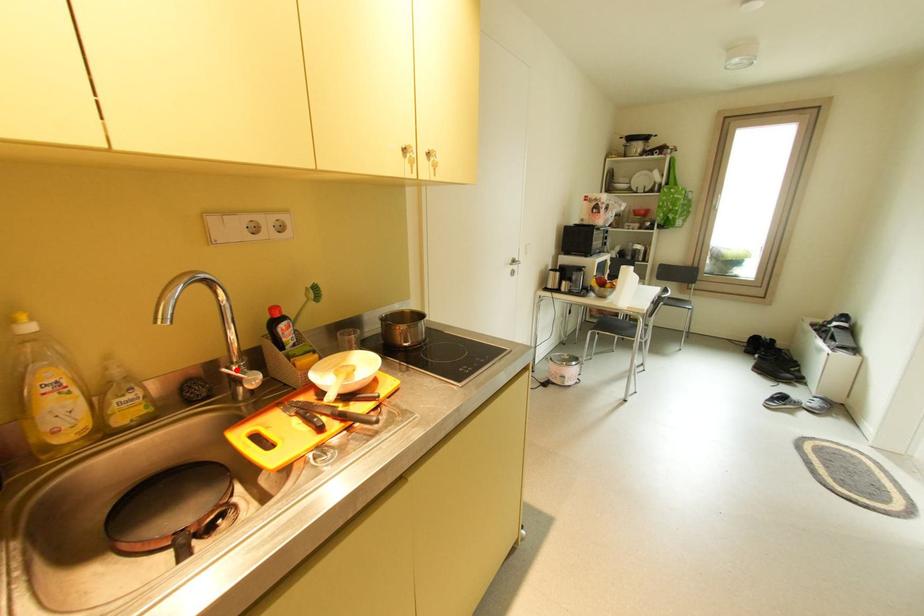
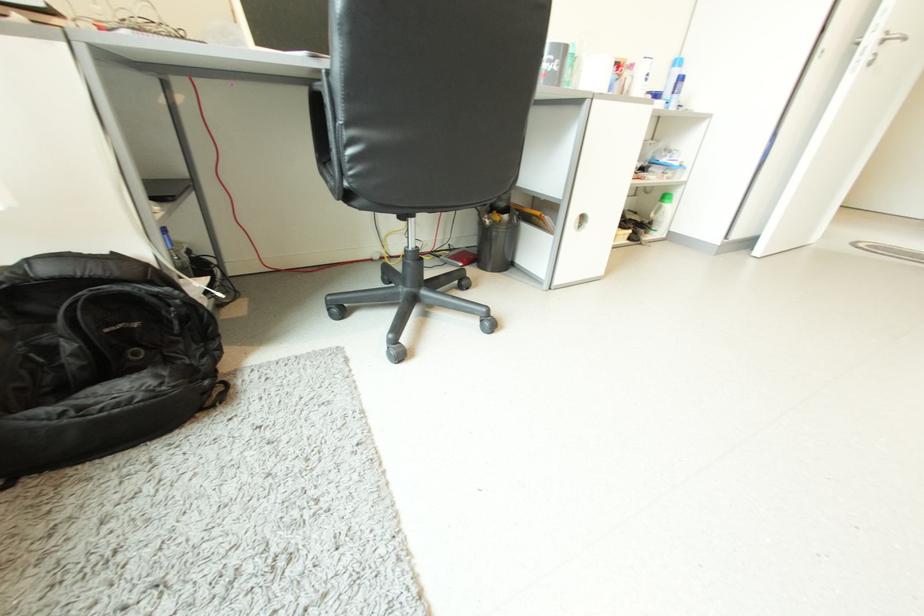
Question: I am providing you with two images of the same scene from different viewpoints. A red point is marked on the first image. Can you still see the location of the red point in image 2?

Choices:
 (A) Yes
 (B) No

Answer: (B)